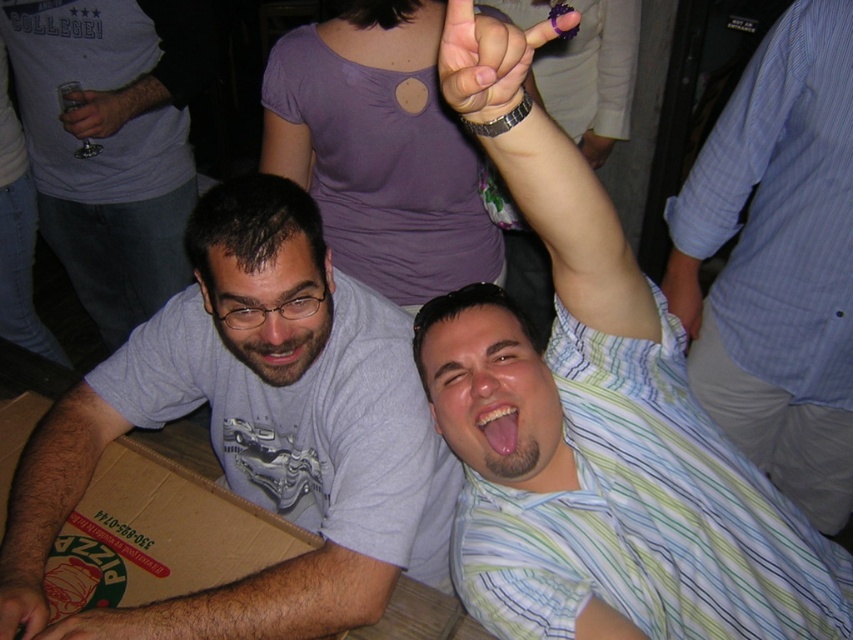
Between blue striped shirt at upper right and black matte hand at lower left, which one appears on the right side from the viewer's perspective?

From the viewer's perspective, blue striped shirt at upper right appears more on the right side.

Between blue striped shirt at upper right and black matte hand at lower left, which one has less height?

black matte hand at lower left

What do you see at coordinates (776, 260) in the screenshot?
I see `blue striped shirt at upper right` at bounding box center [776, 260].

Image resolution: width=853 pixels, height=640 pixels. I want to click on blue striped shirt at upper right, so click(776, 260).

Who is shorter, blue striped shirt at upper right or hair at lower left?

hair at lower left

I want to click on blue striped shirt at upper right, so click(x=776, y=260).

Where is `blue striped shirt at upper right`? This screenshot has height=640, width=853. blue striped shirt at upper right is located at coordinates (776, 260).

What do you see at coordinates (488, 58) in the screenshot? This screenshot has height=640, width=853. I see `purple plastic ring at upper center` at bounding box center [488, 58].

Which is above, purple plastic ring at upper center or hair at lower left?

purple plastic ring at upper center is above.

Is point (437, 65) more distant than point (78, 627)?

No.

Locate an element on the screen. The height and width of the screenshot is (640, 853). purple plastic ring at upper center is located at coordinates (488, 58).